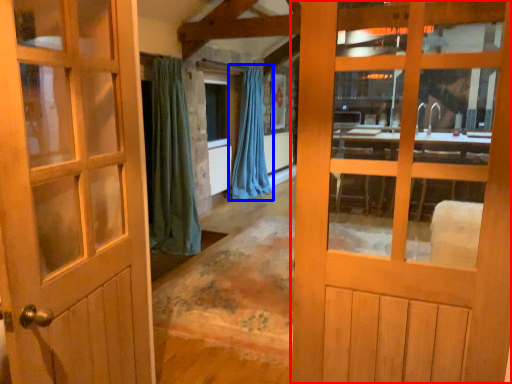
Question: Which object is further to the camera taking this photo, door (highlighted by a red box) or curtain (highlighted by a blue box)?

Choices:
 (A) door
 (B) curtain

Answer: (B)